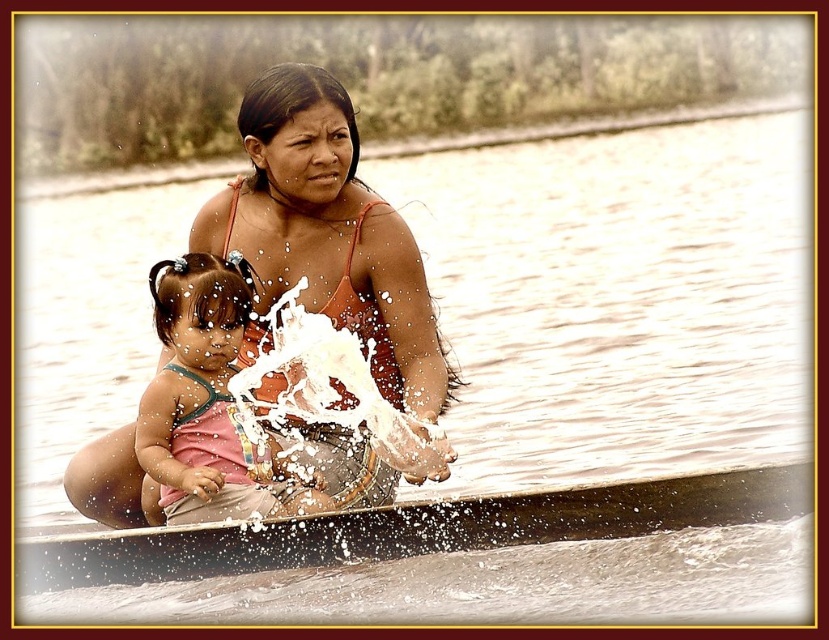
Is matte orange tank top at center closer to the viewer compared to pink fabric dress at center?

Yes, matte orange tank top at center is in front of pink fabric dress at center.

Between matte orange tank top at center and pink fabric dress at center, which one appears on the left side from the viewer's perspective?

pink fabric dress at center is more to the left.

Between point (413, 304) and point (231, 356), which one is positioned behind?

The point (413, 304) is more distant.

At what (x,y) coordinates should I click in order to perform the action: click on matte orange tank top at center. Please return your answer as a coordinate pair (x, y). Image resolution: width=829 pixels, height=640 pixels. Looking at the image, I should click on (328, 232).

Between wooden canoe at center and pink fabric dress at center, which one has more height?

With more height is pink fabric dress at center.

Is wooden canoe at center closer to camera compared to pink fabric dress at center?

Yes, it is in front of pink fabric dress at center.

This screenshot has width=829, height=640. What do you see at coordinates (411, 529) in the screenshot? I see `wooden canoe at center` at bounding box center [411, 529].

This screenshot has height=640, width=829. I want to click on wooden canoe at center, so click(x=411, y=529).

Is point (337, 458) positioned before point (691, 522)?

No, (337, 458) is further to viewer.

Is matte orange tank top at center taller than wooden canoe at center?

Indeed, matte orange tank top at center has a greater height compared to wooden canoe at center.

Is point (257, 333) positioned before point (579, 500)?

No, (257, 333) is further to viewer.

This screenshot has width=829, height=640. In order to click on matte orange tank top at center in this screenshot , I will do `click(328, 232)`.